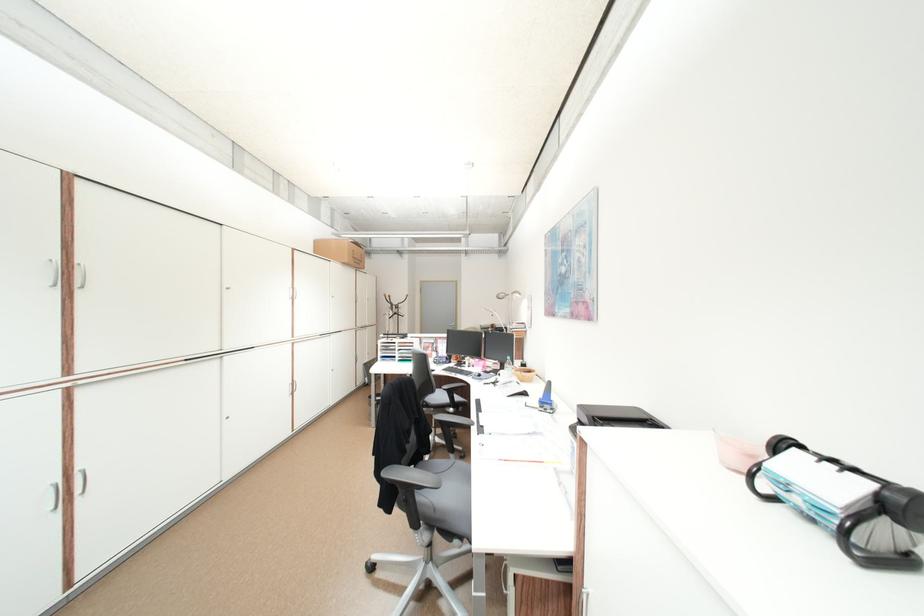
Where would you sit the grey chair sitting surface? Please return your answer as a coordinate pair (x, y).

(458, 479)